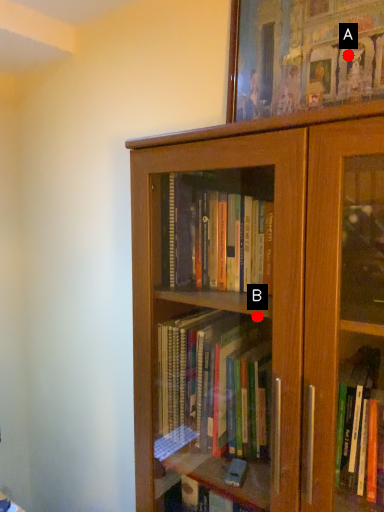
Question: Two points are circled on the image, labeled by A and B beside each circle. Which of the following is the closest to the observer?

Choices:
 (A) A is closer
 (B) B is closer

Answer: (A)